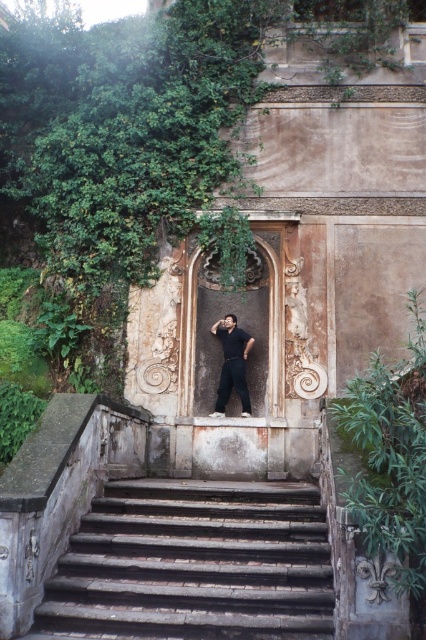
Question: Among these objects, which one is nearest to the camera?

Choices:
 (A) rustic stone door at center
 (B) dark gray cotton pants at center
 (C) green leafy ivy at lower right
 (D) dark gray stone stairs at center

Answer: (C)

Question: Is rustic stone door at center thinner than dark gray cotton pants at center?

Choices:
 (A) no
 (B) yes

Answer: (B)

Question: Is dark gray stone stairs at center below green leafy ivy at lower right?

Choices:
 (A) yes
 (B) no

Answer: (A)

Question: Among these objects, which one is nearest to the camera?

Choices:
 (A) green leafy ivy at lower right
 (B) dark gray cotton pants at center
 (C) dark gray stone stairs at center

Answer: (A)

Question: Does dark gray stone stairs at center have a smaller size compared to rustic stone door at center?

Choices:
 (A) yes
 (B) no

Answer: (B)

Question: Which object appears farthest from the camera in this image?

Choices:
 (A) dark gray stone stairs at center
 (B) dark gray cotton pants at center
 (C) green leafy ivy at lower right
 (D) rustic stone door at center

Answer: (B)